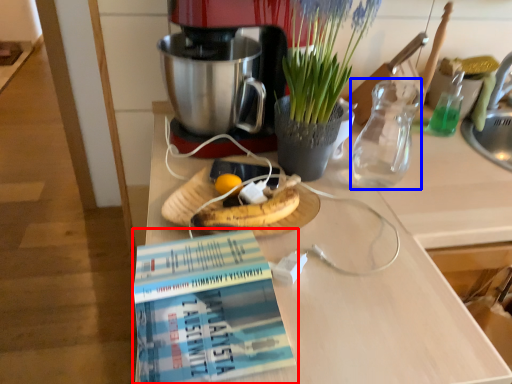
Question: Which object is further to the camera taking this photo, book (highlighted by a red box) or tea pot (highlighted by a blue box)?

Choices:
 (A) book
 (B) tea pot

Answer: (B)